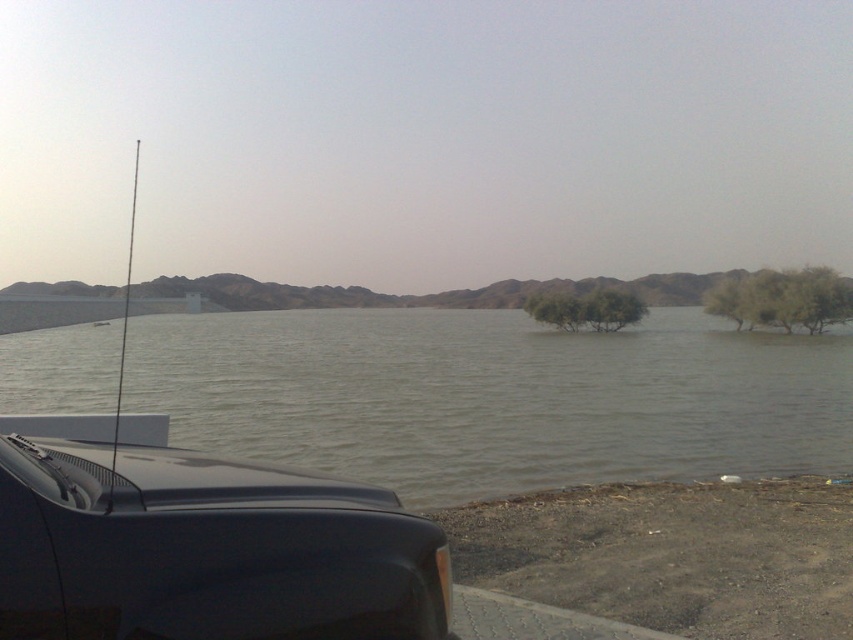
Is shiny black car at left to the left of green leafy tree at right from the viewer's perspective?

Indeed, shiny black car at left is positioned on the left side of green leafy tree at right.

The image size is (853, 640). What do you see at coordinates (199, 540) in the screenshot?
I see `shiny black car at left` at bounding box center [199, 540].

Is point (433, 573) positioned behind point (811, 275)?

No, it is not.

Find the location of a particular element. This screenshot has height=640, width=853. shiny black car at left is located at coordinates (x=199, y=540).

Consider the image. Is glossy black car at lower left wider than green leafy tree at center?

In fact, glossy black car at lower left might be narrower than green leafy tree at center.

The image size is (853, 640). What do you see at coordinates (200, 544) in the screenshot? I see `glossy black car at lower left` at bounding box center [200, 544].

Is point (196, 504) less distant than point (538, 296)?

Yes, point (196, 504) is in front of point (538, 296).

The height and width of the screenshot is (640, 853). I want to click on glossy black car at lower left, so tap(200, 544).

Is shiny black car at left taller than glossy black car at lower left?

Indeed, shiny black car at left has a greater height compared to glossy black car at lower left.

Does shiny black car at left come in front of glossy black car at lower left?

No, it is not.

Is point (325, 497) positioned in front of point (160, 486)?

No, it is not.

The width and height of the screenshot is (853, 640). I want to click on shiny black car at left, so click(x=199, y=540).